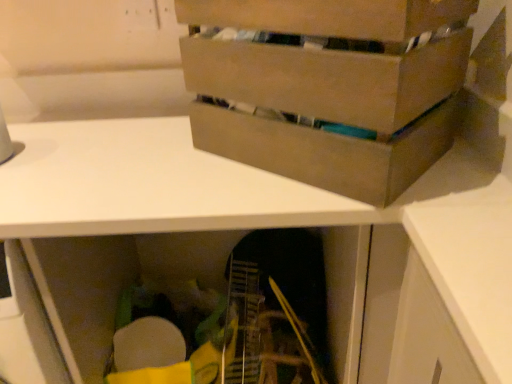
In order to click on vacant space situated on the left part of brown cardboard box at upper center in this screenshot , I will do `click(145, 160)`.